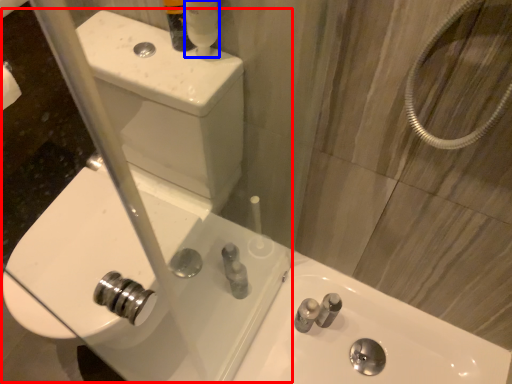
Question: Among these objects, which one is nearest to the camera, sink (highlighted by a red box) or mouthwash (highlighted by a blue box)?

Choices:
 (A) sink
 (B) mouthwash

Answer: (A)